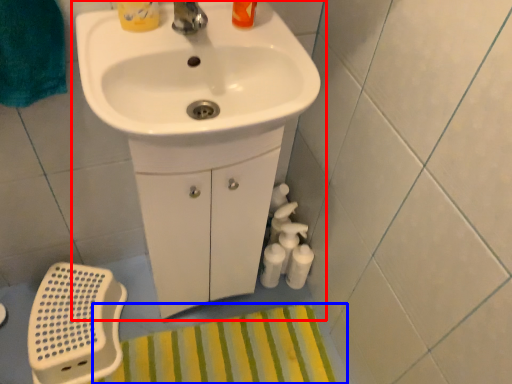
Question: Which object appears farthest to the camera in this image, sink (highlighted by a red box) or bath mat (highlighted by a blue box)?

Choices:
 (A) sink
 (B) bath mat

Answer: (B)